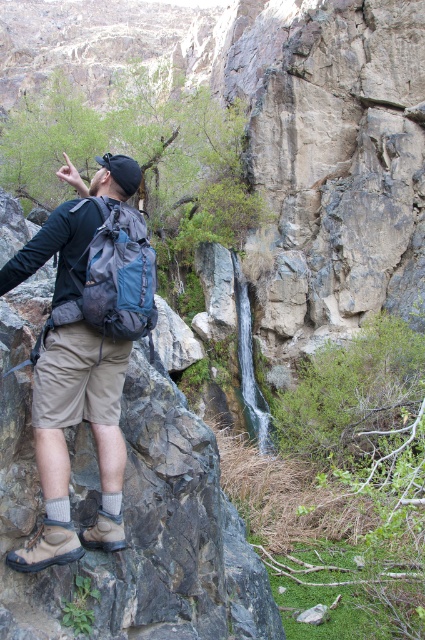
Does matte blue backpack at center have a greater height compared to matte blue backpack at left?

Correct, matte blue backpack at center is much taller as matte blue backpack at left.

Is matte blue backpack at center above matte blue backpack at left?

No, matte blue backpack at center is not above matte blue backpack at left.

Is point (122, 451) more distant than point (101, 291)?

Yes, point (122, 451) is farther from viewer.

The width and height of the screenshot is (425, 640). Identify the location of matte blue backpack at center. (85, 348).